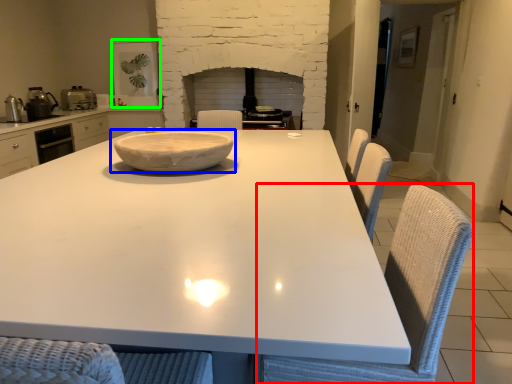
Question: Based on their relative distances, which object is farther from swivel chair (highlighted by a red box)? Choose from bowl (highlighted by a blue box) and appliance (highlighted by a green box).

Choices:
 (A) bowl
 (B) appliance

Answer: (B)